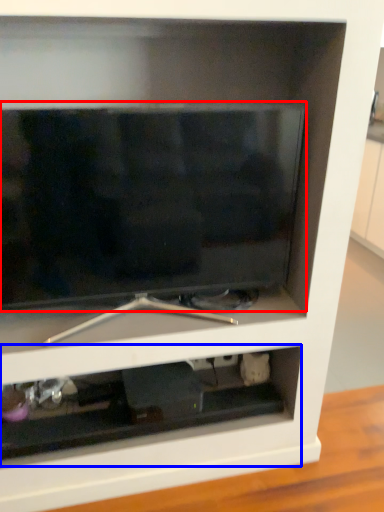
Question: Which object appears farthest to the camera in this image, television (highlighted by a red box) or cabinet (highlighted by a blue box)?

Choices:
 (A) television
 (B) cabinet

Answer: (B)